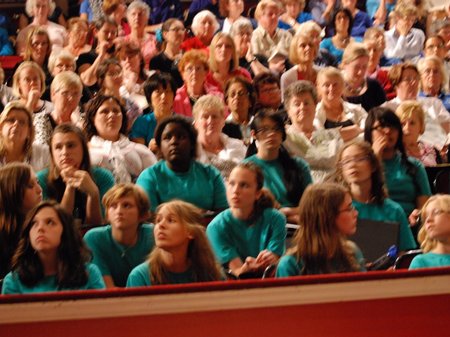
What are the coordinates of `black folder` in the screenshot? It's located at (371, 246).